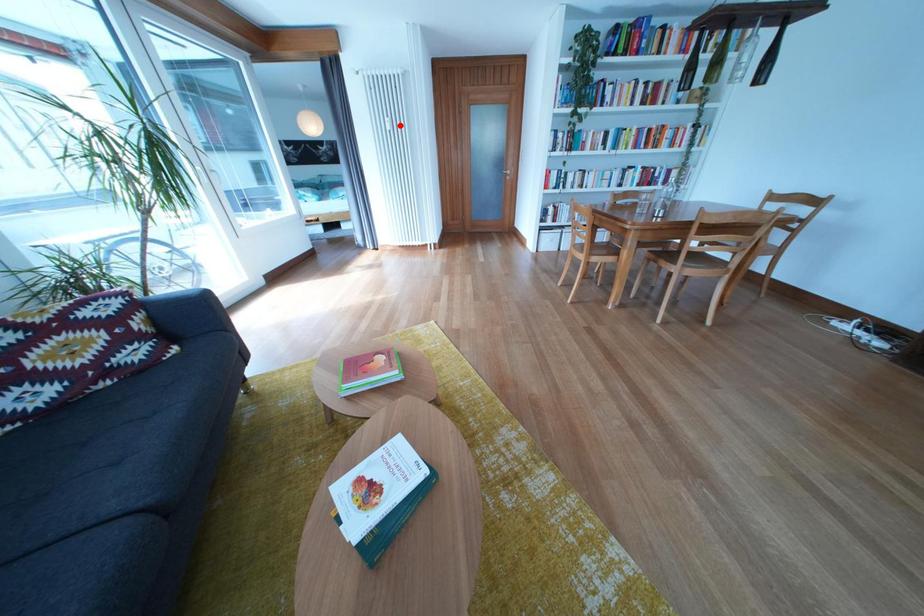
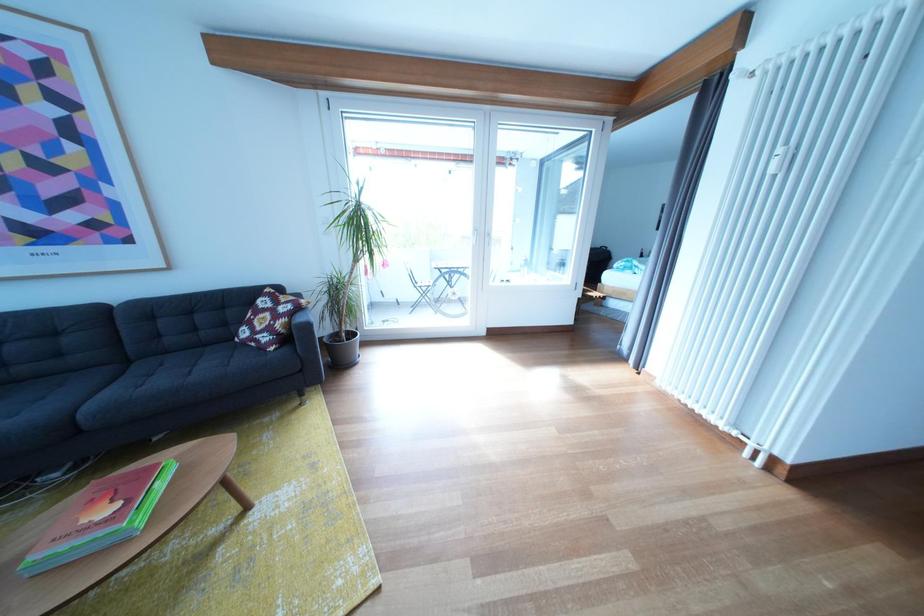
Question: I am providing you with two images of the same scene from different viewpoints. A red point is marked on the first image. Is the red point's position out of view in image 2?

Choices:
 (A) Yes
 (B) No

Answer: (B)